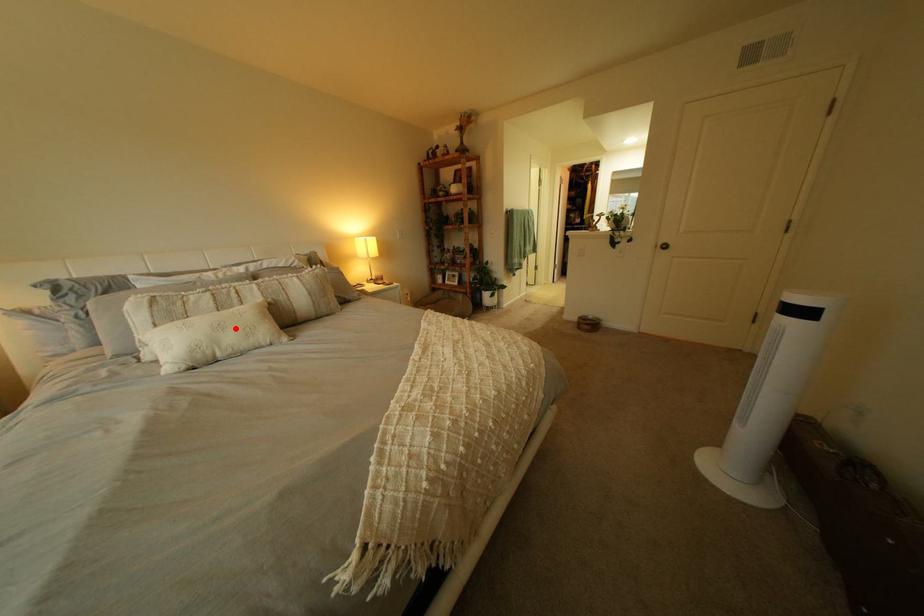
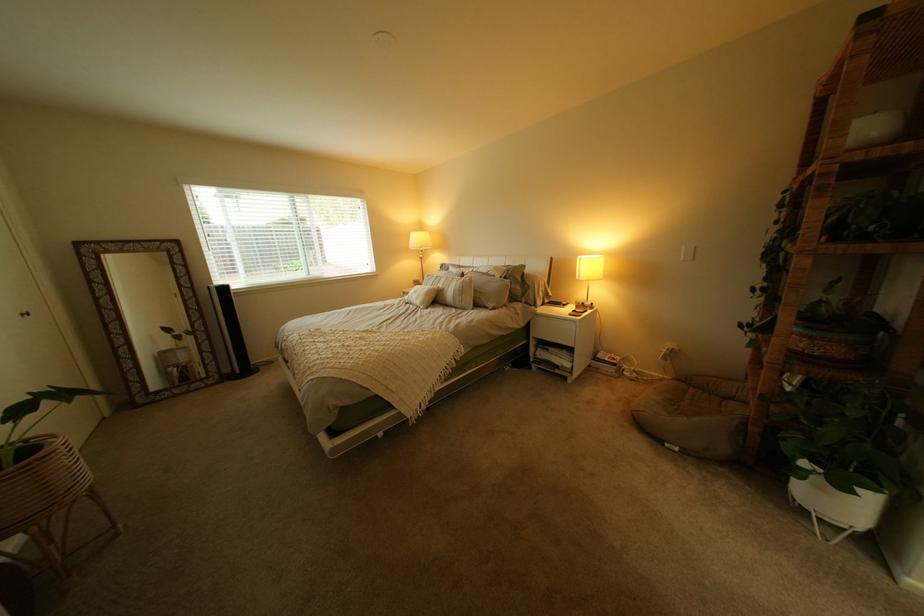
Find the pixel in the second image that matches the highlighted location in the first image.

(431, 293)